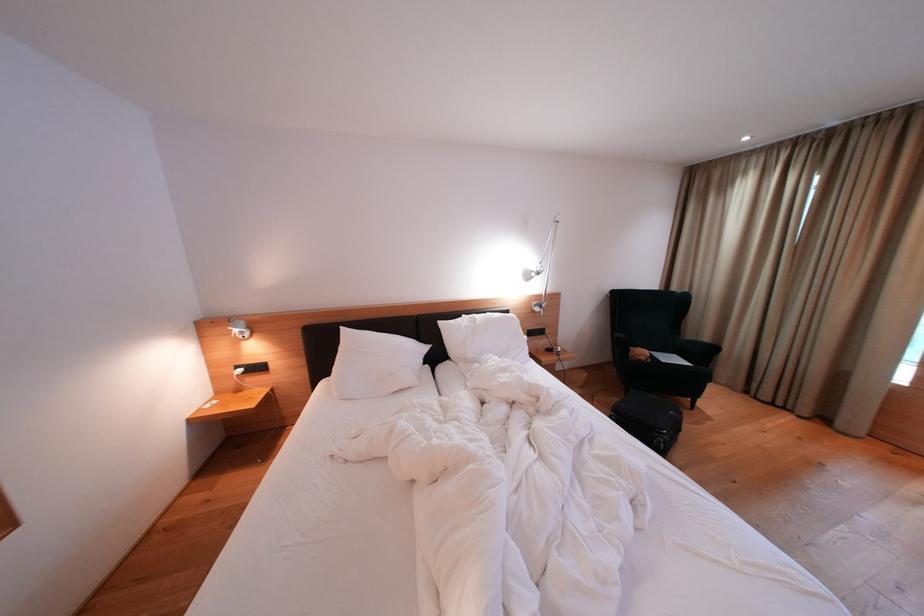
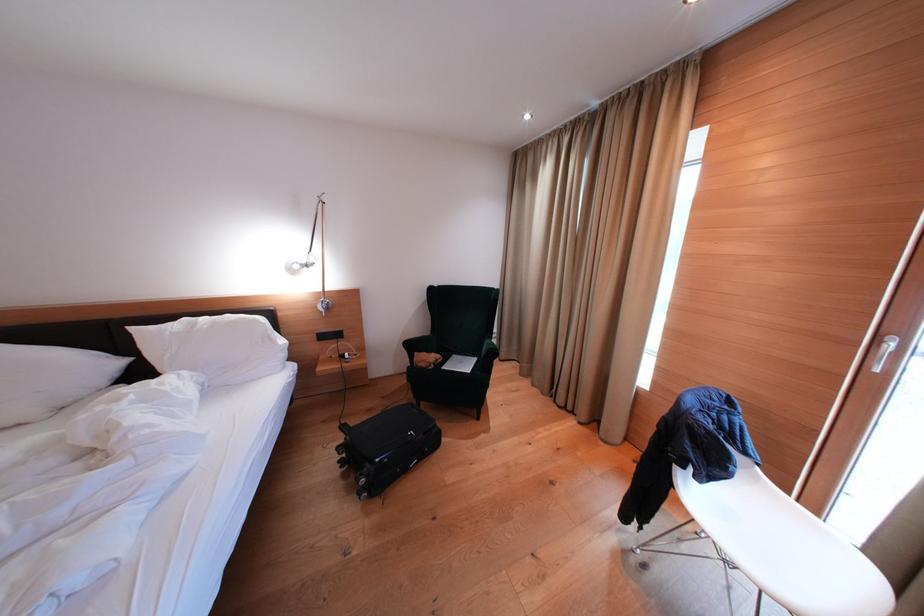
Question: What movement of the cameraman would produce the second image?

Choices:
 (A) Left
 (B) Right
 (C) Forward
 (D) Backward

Answer: (B)